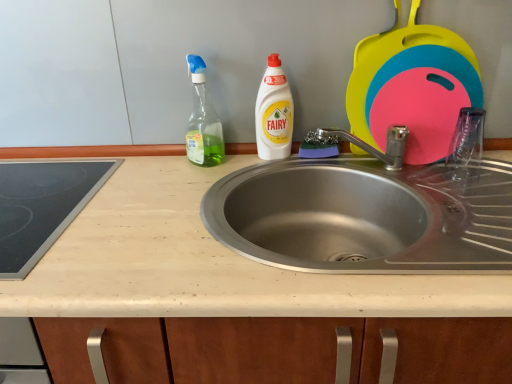
Image resolution: width=512 pixels, height=384 pixels. What are the coordinates of `empty space that is ontop of black glass cooktop at left (from a real-world perspective)` in the screenshot? It's located at (38, 188).